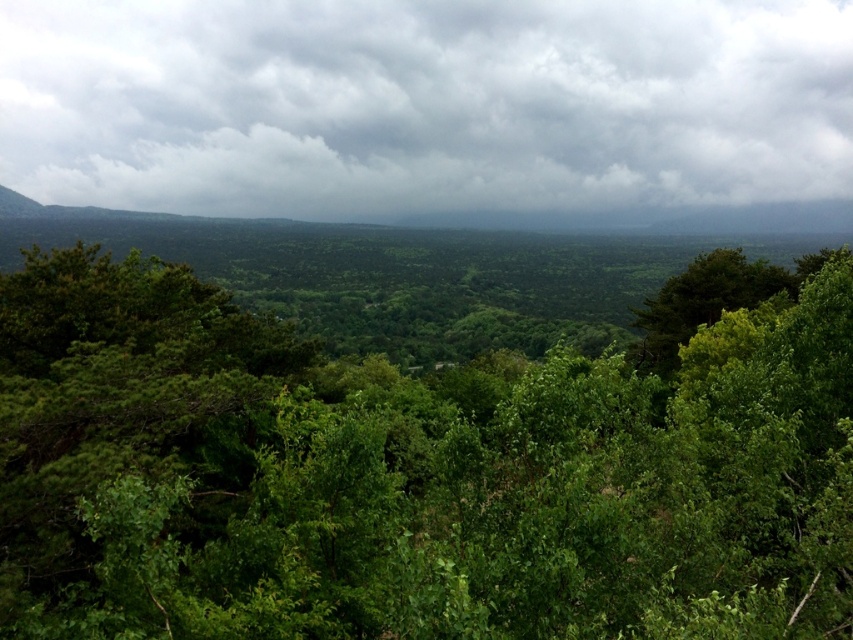
You are an environmental scientist studying the landscape. You notice the green leafy tree at center and the gray fluffy cloud at upper center. Which object is positioned lower in the scene?

The green leafy tree at center is located below the gray fluffy cloud at upper center, so the green leafy tree at center is positioned lower in the scene.

You are an environmental scientist assessing the health of a forest. You observe two green leafy trees in the image. Which tree, the green leafy tree at center or the green leafy tree at right, is larger in size?

The green leafy tree at center is bigger than the green leafy tree at right according to the description provided.

You are an environmental scientist assessing the landscape. You notice the green leafy tree at center and the gray fluffy cloud at upper center. Which of these two objects appears narrower in the image?

The green leafy tree at center has a lesser width compared to the gray fluffy cloud at upper center, so it appears narrower.